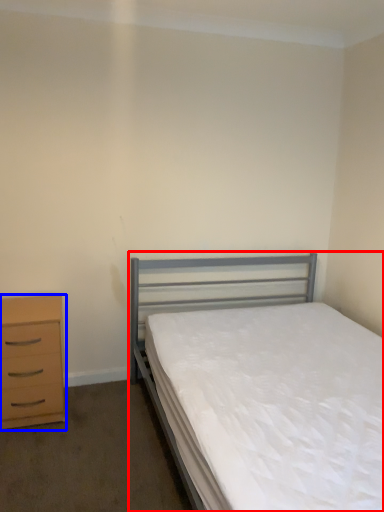
Question: Which object is closer to the camera taking this photo, bed (highlighted by a red box) or chest of drawers (highlighted by a blue box)?

Choices:
 (A) bed
 (B) chest of drawers

Answer: (A)